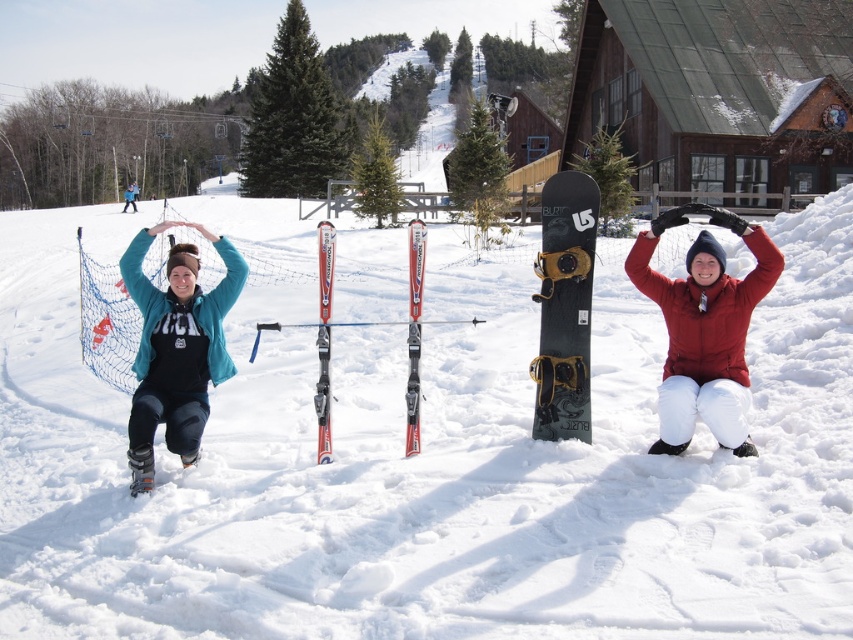
Question: In this image, where is white snow at center located relative to red metallic skis at center?

Choices:
 (A) left
 (B) right

Answer: (A)

Question: Is black matte snowboard at center positioned before shiny red skis at center?

Choices:
 (A) yes
 (B) no

Answer: (A)

Question: Which point appears closest to the camera in this image?

Choices:
 (A) (410, 440)
 (B) (563, 268)
 (C) (326, 460)

Answer: (B)

Question: Is brushed metal ski boots at lower left wider than black matte snowboard at center?

Choices:
 (A) no
 (B) yes

Answer: (A)

Question: Which point is closer to the camera?

Choices:
 (A) (317, 461)
 (B) (62, 385)

Answer: (A)

Question: Among these points, which one is farthest from the camera?

Choices:
 (A) (387, 307)
 (B) (410, 397)
 (C) (192, 419)

Answer: (A)